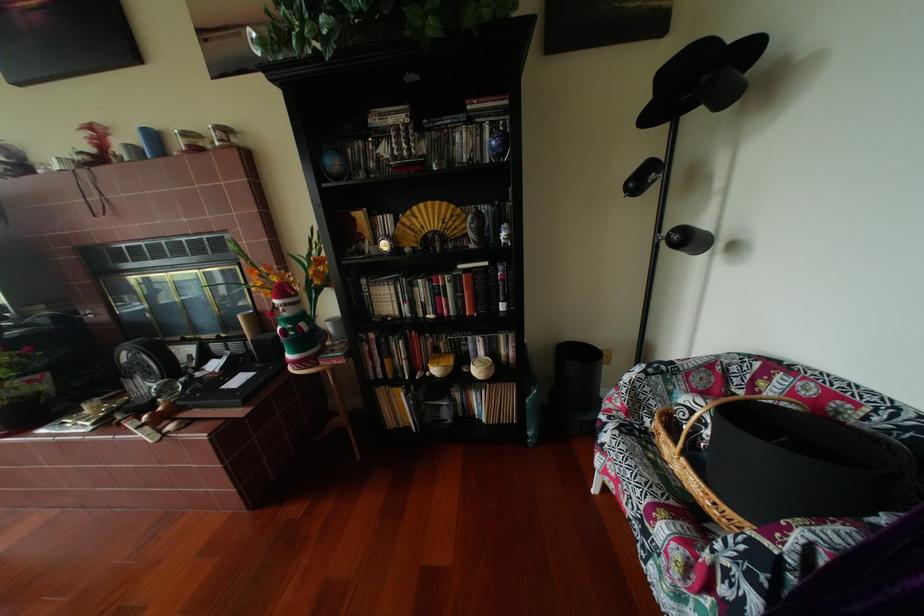
What do you see at coordinates (577, 387) in the screenshot?
I see `the black trash can` at bounding box center [577, 387].